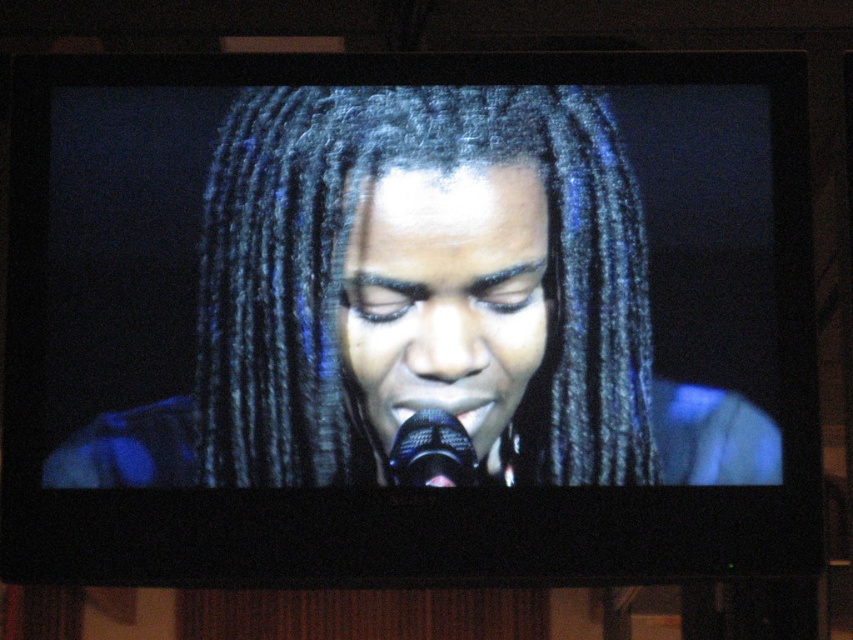
Consider the image. Which is more to the left, black/dark hair at center or black metallic microphone at center?

Positioned to the left is black/dark hair at center.

Measure the distance between black/dark hair at center and black metallic microphone at center.

black/dark hair at center and black metallic microphone at center are 10.02 inches apart.

Which is in front, point (550, 209) or point (450, 451)?

Point (450, 451) is more forward.

Where is `black/dark hair at center`? black/dark hair at center is located at coordinates (347, 296).